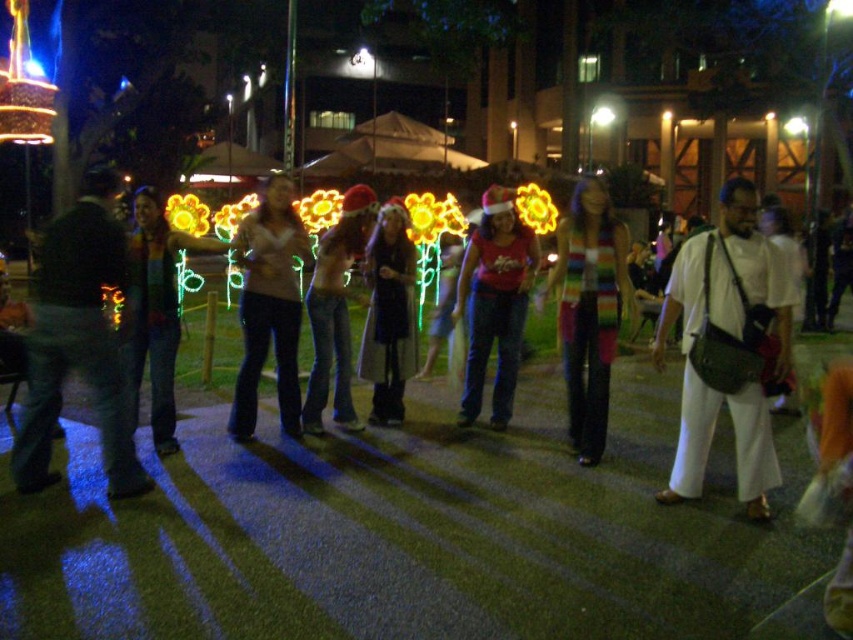
You are a photographer at the event and want to capture both the matte red shirt at center and the rainbow striped sweater at center in a single shot. Based on their positions, which one is positioned higher in the frame?

The matte red shirt at center is located above the rainbow striped sweater at center, so it is positioned higher in the frame.

You are at a festive outdoor event and see two people wearing a matte red shirt at center and a gray fabric coat at center. Which one is positioned more to the right?

The matte red shirt at center is positioned more to the right than the gray fabric coat at center.

You are standing at the center of the image and see a point marked at coordinates [494,301]. Which object is this point located on?

The point at coordinates [494,301] is located on the matte red shirt at center.